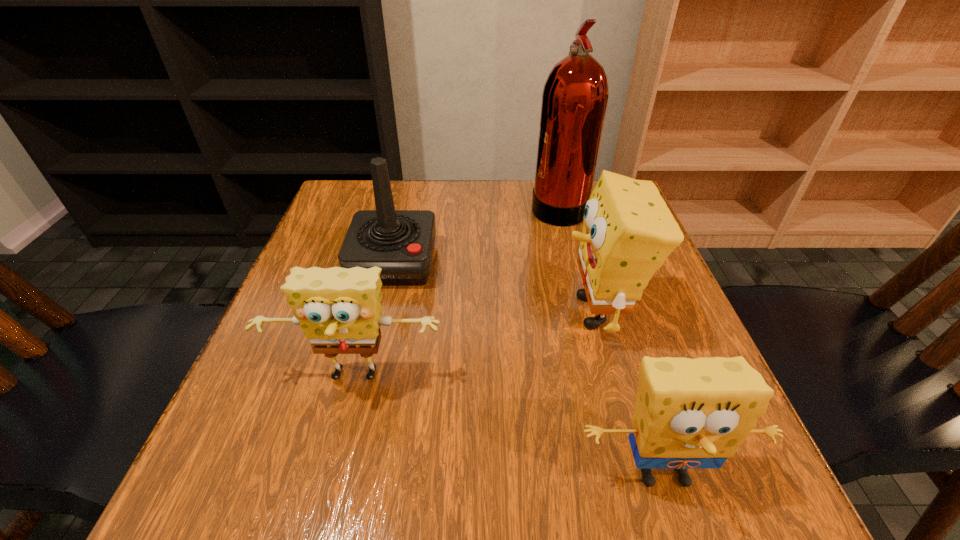
This screenshot has height=540, width=960. Identify the location of the closest sponge to the farthest sponge. (689, 413).

Find the location of a particular element. The height and width of the screenshot is (540, 960). sponge object that ranks as the second closest to the second nearest sponge is located at coordinates (628, 231).

Where is `free space that satisfies the following two spatial constraints: 1. on the front-facing side of the fire extinguisher; 2. on the front-facing side of the joystick`? free space that satisfies the following two spatial constraints: 1. on the front-facing side of the fire extinguisher; 2. on the front-facing side of the joystick is located at coordinates (572, 262).

The image size is (960, 540). Find the location of `free point that satisfies the following two spatial constraints: 1. on the front-facing side of the tallest object; 2. on the front-facing side of the joystick`. free point that satisfies the following two spatial constraints: 1. on the front-facing side of the tallest object; 2. on the front-facing side of the joystick is located at coordinates (572, 262).

Identify the location of vacant space that satisfies the following two spatial constraints: 1. on the face of the farthest sponge; 2. on the face of the second nearest object. (616, 379).

Locate an element on the screen. The image size is (960, 540). vacant position in the image that satisfies the following two spatial constraints: 1. on the front-facing side of the farthest object; 2. on the front-facing side of the joystick is located at coordinates (572, 262).